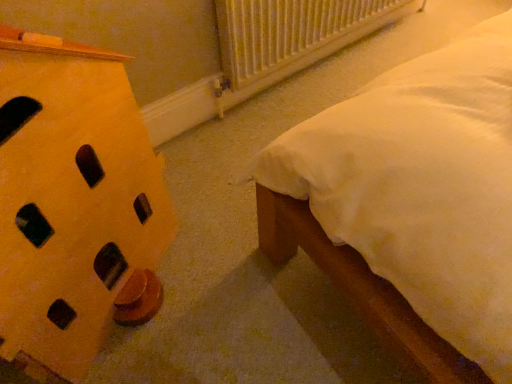
Question: Is yellow matte wooden block at left outside yellow matte nightstand at left?

Choices:
 (A) yes
 (B) no

Answer: (A)

Question: Can you confirm if yellow matte wooden block at left is bigger than yellow matte nightstand at left?

Choices:
 (A) no
 (B) yes

Answer: (B)

Question: From a real-world perspective, is yellow matte wooden block at left below yellow matte nightstand at left?

Choices:
 (A) no
 (B) yes

Answer: (A)

Question: From a real-world perspective, does yellow matte wooden block at left stand above yellow matte nightstand at left?

Choices:
 (A) no
 (B) yes

Answer: (B)

Question: Can you confirm if yellow matte wooden block at left is wider than yellow matte nightstand at left?

Choices:
 (A) yes
 (B) no

Answer: (B)

Question: Is the position of yellow matte wooden block at left more distant than that of yellow matte nightstand at left?

Choices:
 (A) yes
 (B) no

Answer: (B)

Question: Is white plastic radiator at upper center far away from yellow matte wooden block at left?

Choices:
 (A) yes
 (B) no

Answer: (B)

Question: Can you confirm if white plastic radiator at upper center is positioned to the left of yellow matte wooden block at left?

Choices:
 (A) yes
 (B) no

Answer: (B)

Question: Does white plastic radiator at upper center have a lesser height compared to yellow matte wooden block at left?

Choices:
 (A) no
 (B) yes

Answer: (B)

Question: Does white plastic radiator at upper center come in front of yellow matte wooden block at left?

Choices:
 (A) yes
 (B) no

Answer: (B)

Question: Is white plastic radiator at upper center facing towards yellow matte wooden block at left?

Choices:
 (A) yes
 (B) no

Answer: (B)

Question: Is white plastic radiator at upper center looking in the opposite direction of yellow matte wooden block at left?

Choices:
 (A) yes
 (B) no

Answer: (B)

Question: Is white plastic radiator at upper center at the left side of yellow matte nightstand at left?

Choices:
 (A) yes
 (B) no

Answer: (A)